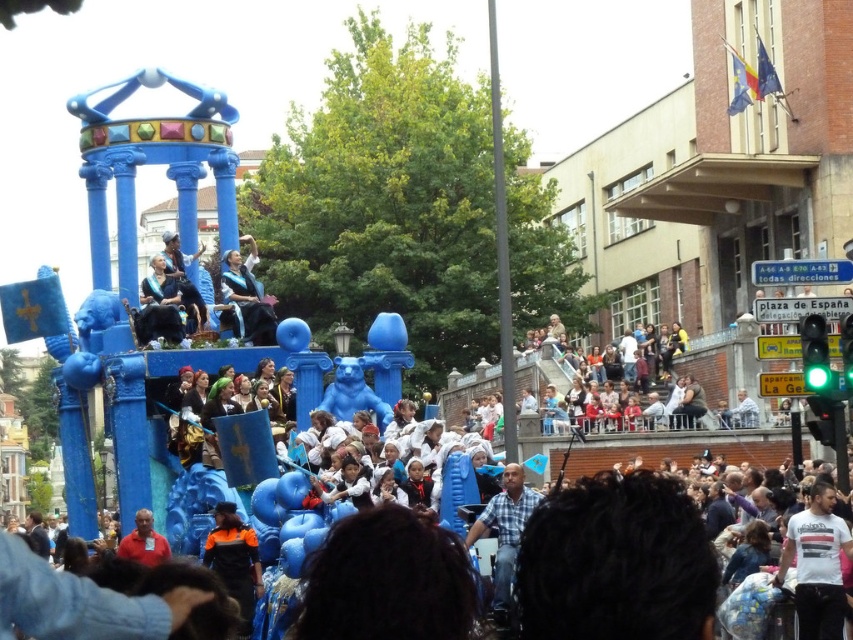
Question: Can you confirm if white cotton t-shirt at lower right is smaller than graduation gown at center?

Choices:
 (A) no
 (B) yes

Answer: (A)

Question: Which of the following is the closest to the observer?

Choices:
 (A) matte black dress at center
 (B) graduation gown at center
 (C) plaid shirt at center
 (D) white cotton t-shirt at lower right

Answer: (C)

Question: Which point is closer to the camera taking this photo?

Choices:
 (A) click(x=235, y=323)
 (B) click(x=532, y=492)
 (C) click(x=196, y=324)
 (D) click(x=837, y=630)

Answer: (D)

Question: Is graduation gown at center above matte orange shirt at lower left?

Choices:
 (A) no
 (B) yes

Answer: (B)

Question: Considering the relative positions of white cotton t-shirt at lower right and matte orange shirt at lower left in the image provided, where is white cotton t-shirt at lower right located with respect to matte orange shirt at lower left?

Choices:
 (A) right
 (B) left

Answer: (A)

Question: Among these objects, which one is farthest from the camera?

Choices:
 (A) matte black outfit at center
 (B) matte orange shirt at lower left
 (C) graduation gown at center

Answer: (A)